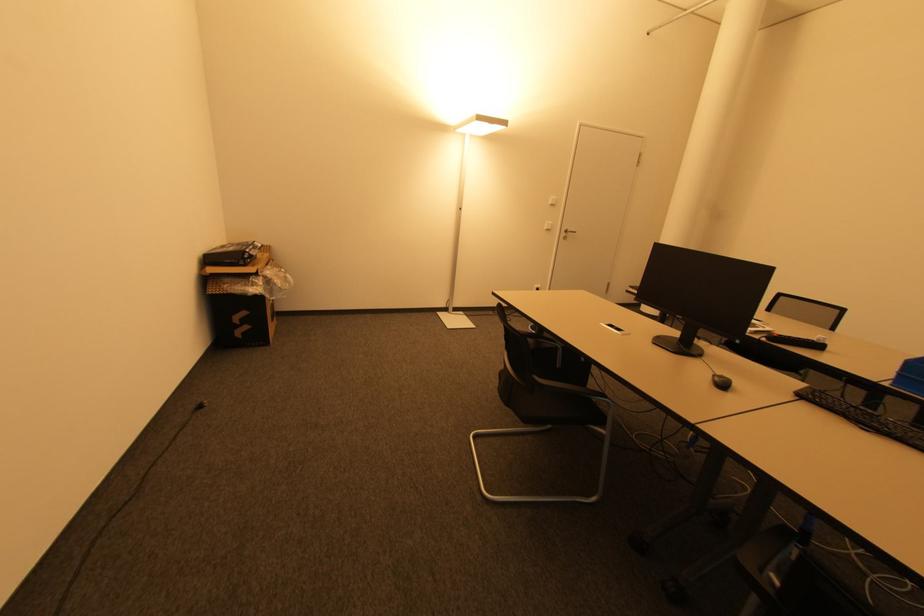
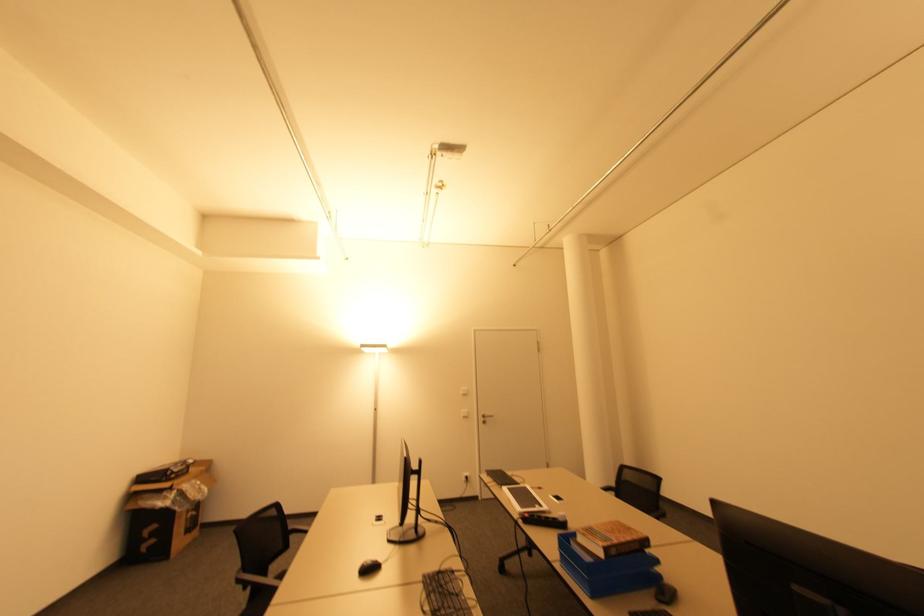
In the second image, find the point that corresponds to (566,238) in the first image.

(485, 422)